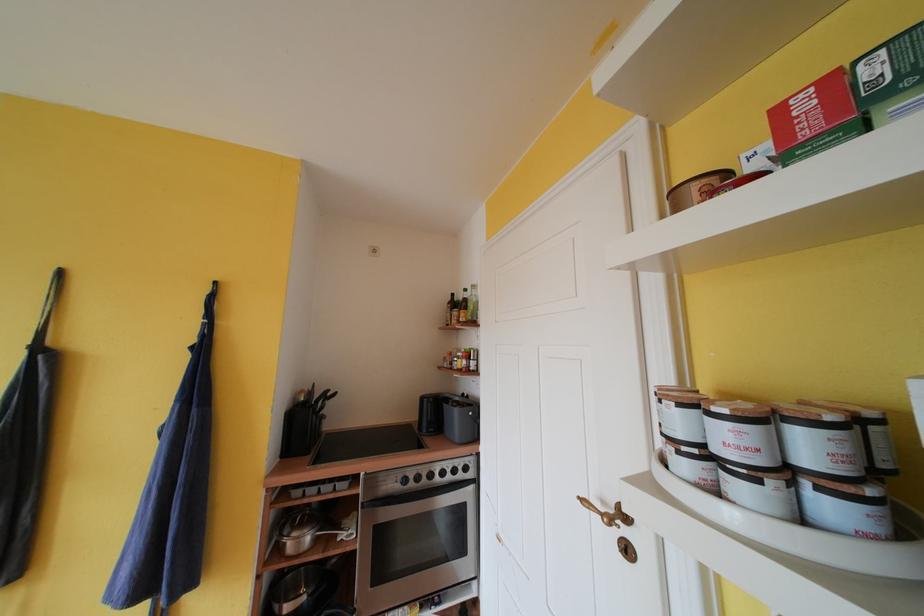
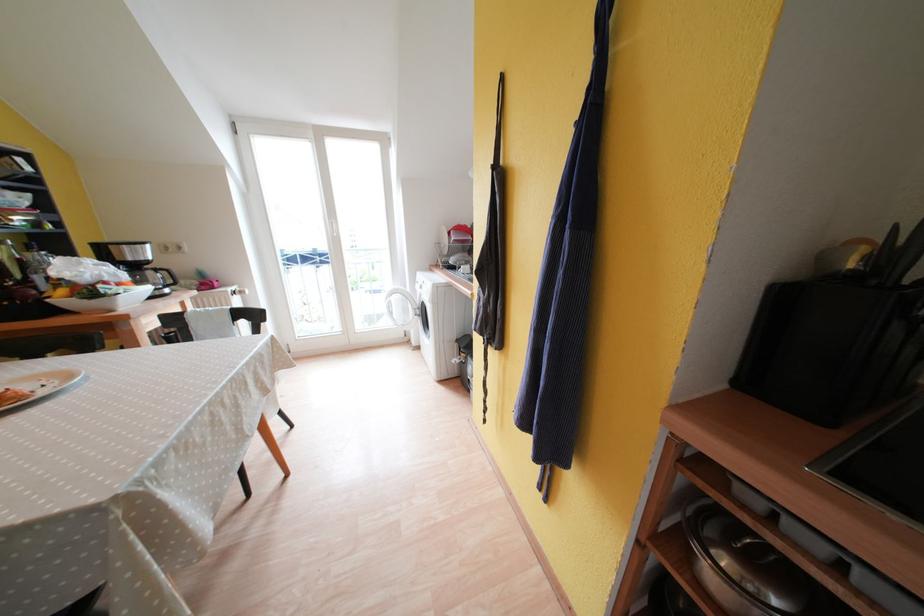
Based on the photo, the first image is from the beginning of the video and the second image is from the end. How did the camera likely rotate when shooting the video?

The camera's rotation is toward left-down.